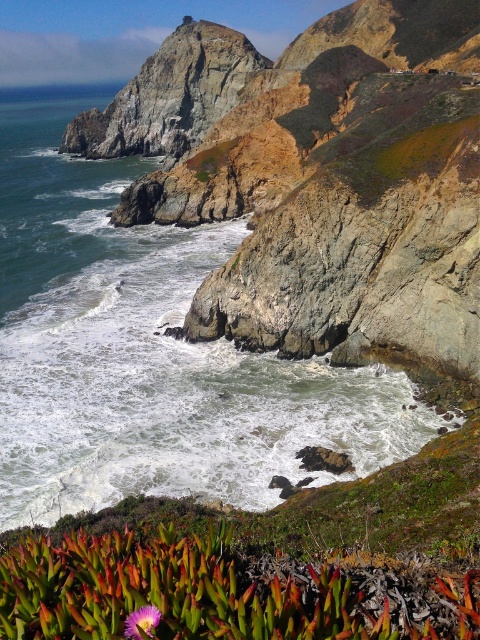
In the scene shown: You are a photographer planning to capture the purple matte flower at lower center and the foamy white water at center in a single frame. Based on their sizes, which object should you focus on to ensure both fit in the shot?

The foamy white water at center might be wider than the purple matte flower at lower center, so focusing on the foamy white water at center would help ensure both fit in the frame since it occupies more width.

You are standing at the base of the cliffs and want to reach the point marked at coordinates point (202, 371). If your drone can fly 150 feet, can it reach that point?

The point (202, 371) is 149.38 feet from the camera, so yes, the drone can reach it since it is within the 150 feet range.